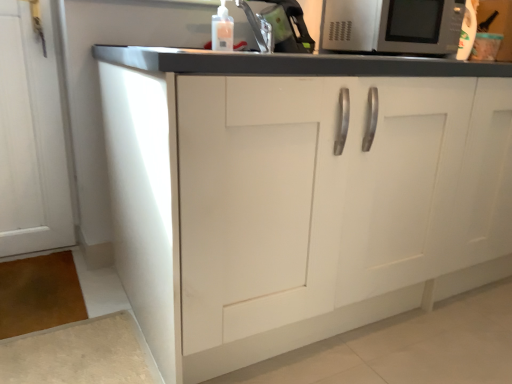
Question: Considering the positions of white matte cabinet at center and translucent plastic bottle at upper center in the image, is white matte cabinet at center taller or shorter than translucent plastic bottle at upper center?

Choices:
 (A) tall
 (B) short

Answer: (A)

Question: Is point (437, 248) closer or farther from the camera than point (224, 11)?

Choices:
 (A) closer
 (B) farther

Answer: (A)

Question: Estimate the real-world distances between objects in this image. Which object is closer to the satin silver microwave at upper right?

Choices:
 (A) translucent plastic bottle at upper center
 (B) transparent plastic sink at upper center
 (C) white matte cabinet at center

Answer: (B)

Question: Which of these objects is positioned farthest from the white matte cabinet at center?

Choices:
 (A) translucent plastic bottle at upper center
 (B) transparent plastic sink at upper center
 (C) satin silver microwave at upper right

Answer: (C)